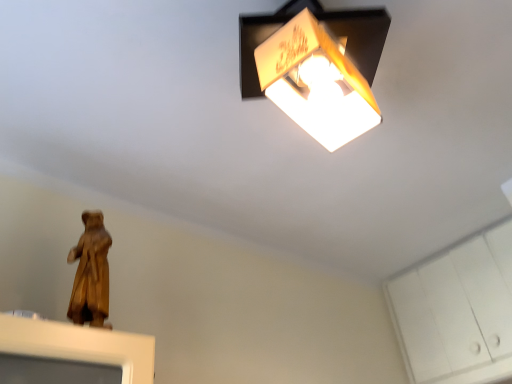
Question: In terms of size, does wooden statue at lower left appear bigger or smaller than white matte cabinet at lower right?

Choices:
 (A) big
 (B) small

Answer: (B)

Question: In terms of height, does wooden statue at lower left look taller or shorter compared to white matte cabinet at lower right?

Choices:
 (A) tall
 (B) short

Answer: (B)

Question: Relative to white matte cabinet at lower right, is wooden statue at lower left in front or behind?

Choices:
 (A) front
 (B) behind

Answer: (A)

Question: In terms of height, does white matte cabinet at lower right look taller or shorter compared to wooden statue at lower left?

Choices:
 (A) short
 (B) tall

Answer: (B)

Question: Is point (419, 294) positioned closer to the camera than point (102, 276)?

Choices:
 (A) closer
 (B) farther

Answer: (B)

Question: In the image, is white matte cabinet at lower right positioned in front of or behind wooden statue at lower left?

Choices:
 (A) behind
 (B) front

Answer: (A)

Question: Based on their sizes in the image, would you say white matte cabinet at lower right is bigger or smaller than wooden statue at lower left?

Choices:
 (A) small
 (B) big

Answer: (B)